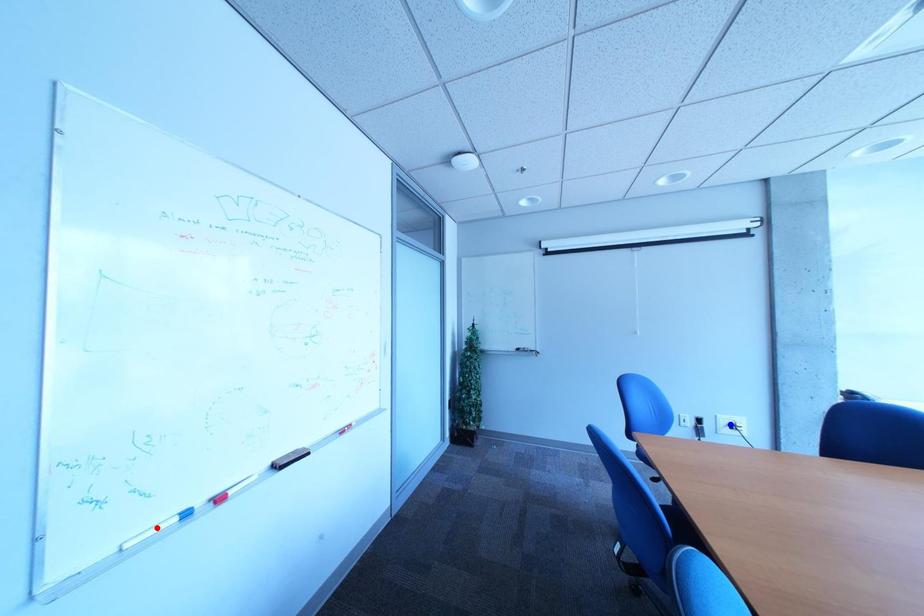
Question: Two points are marked on the image. Which point is closer to the camera?

Choices:
 (A) Blue point is closer.
 (B) Red point is closer.

Answer: (B)